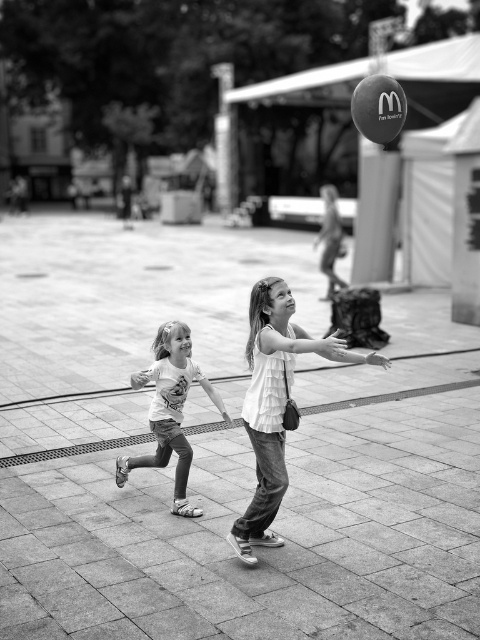
Does white cotton shirt at center appear over matte white t-shirt at lower left?

Yes.

Who is positioned more to the left, white cotton shirt at center or matte white t-shirt at lower left?

matte white t-shirt at lower left

Is point (301, 337) positioned after point (179, 413)?

No, it is not.

This screenshot has width=480, height=640. What are the coordinates of `white cotton shirt at center` in the screenshot? It's located at (275, 403).